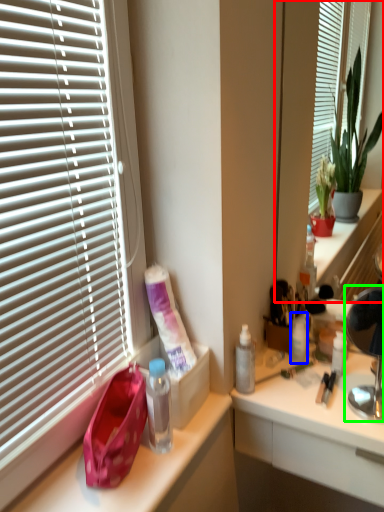
Question: Estimate the real-world distances between objects in this image. Which object is closer to mirror (highlighted by a red box), toiletry (highlighted by a blue box) or lamp (highlighted by a green box)?

Choices:
 (A) toiletry
 (B) lamp

Answer: (A)